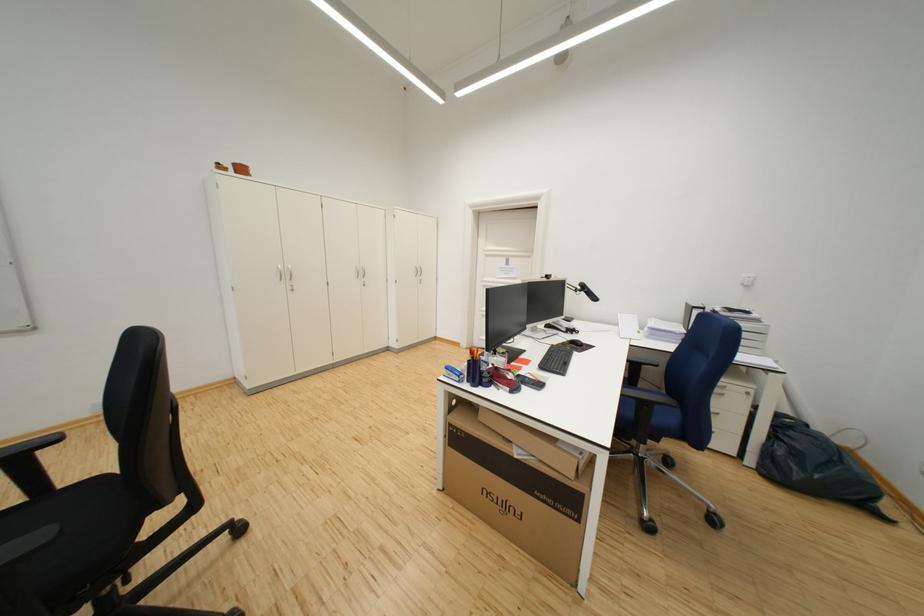
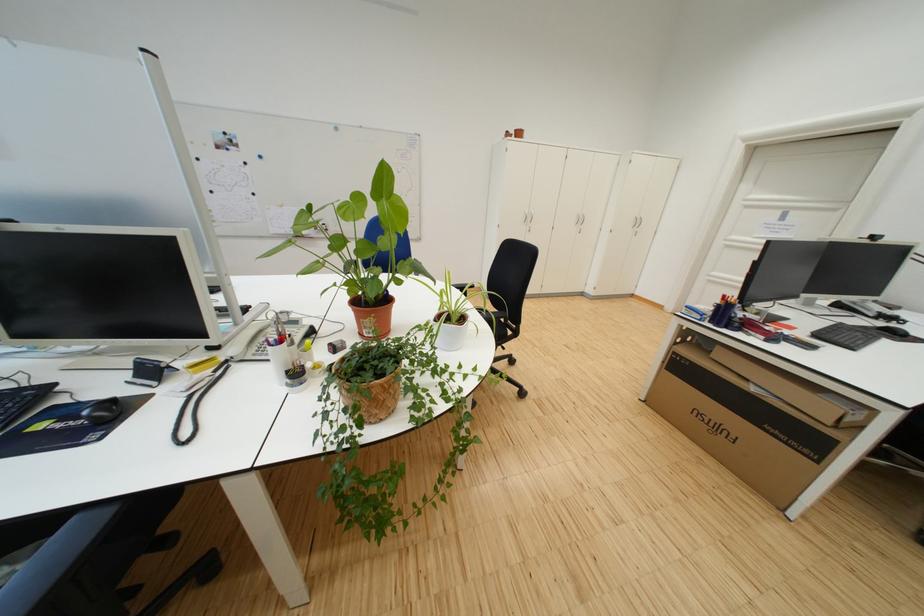
In the second image, find the point that corresponds to point (517, 509) in the first image.

(730, 431)